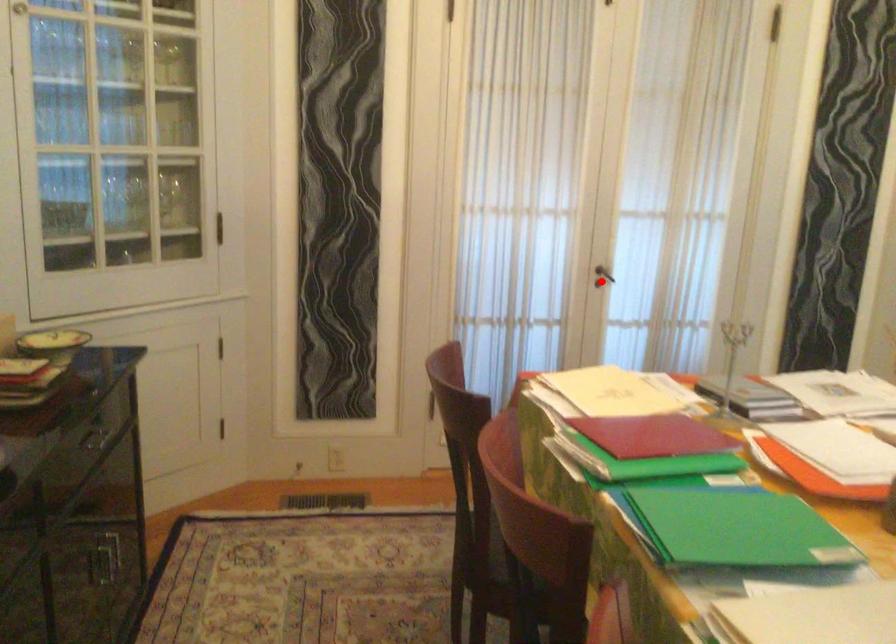
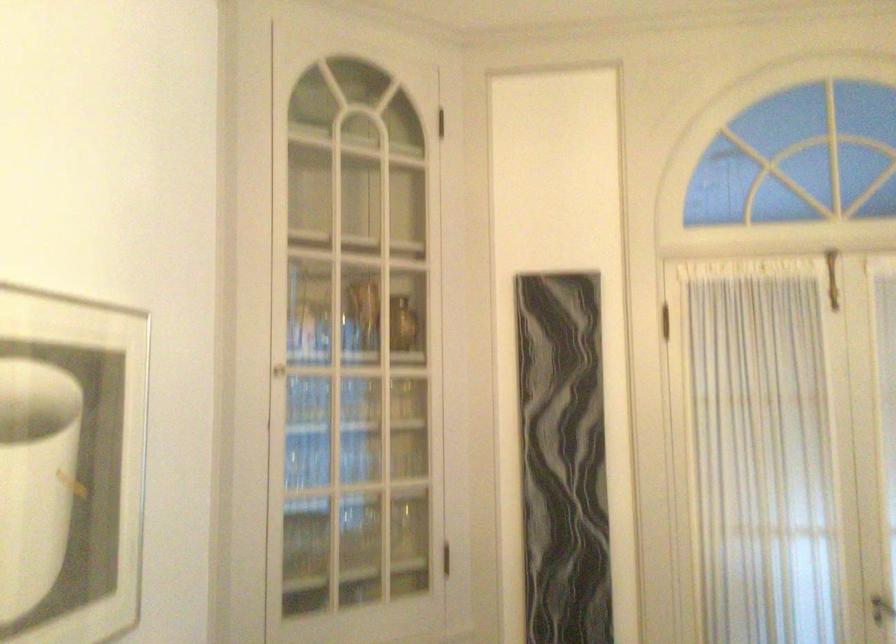
Question: I am providing you with two images of the same scene from different viewpoints. A red point is shown in image1. For the corresponding object point in image2, is it positioned nearer or farther from the camera?

Choices:
 (A) Nearer
 (B) Farther

Answer: (A)